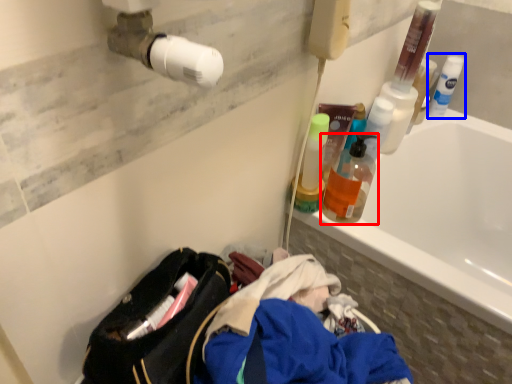
Question: Which object appears farthest to the camera in this image, bottle (highlighted by a red box) or cleaning product (highlighted by a blue box)?

Choices:
 (A) bottle
 (B) cleaning product

Answer: (B)